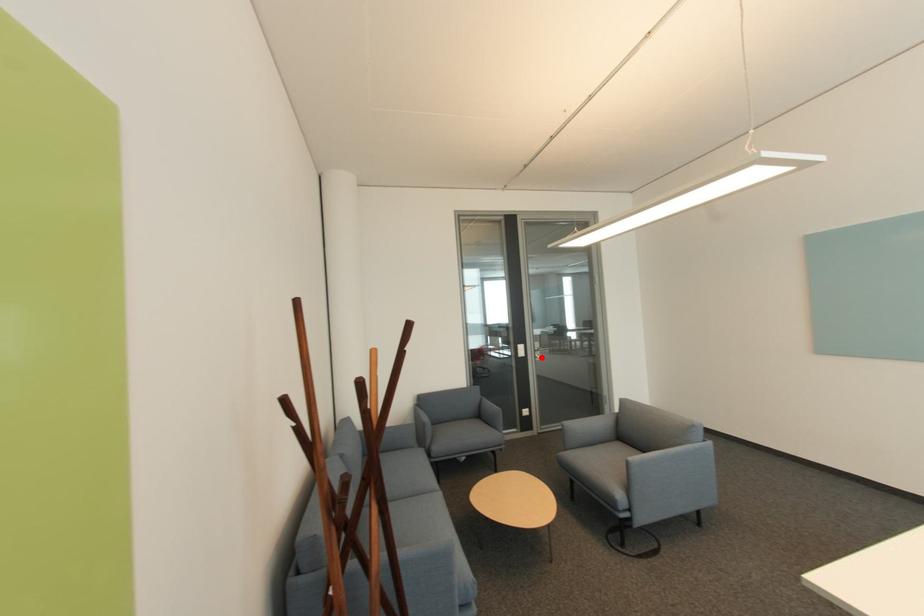
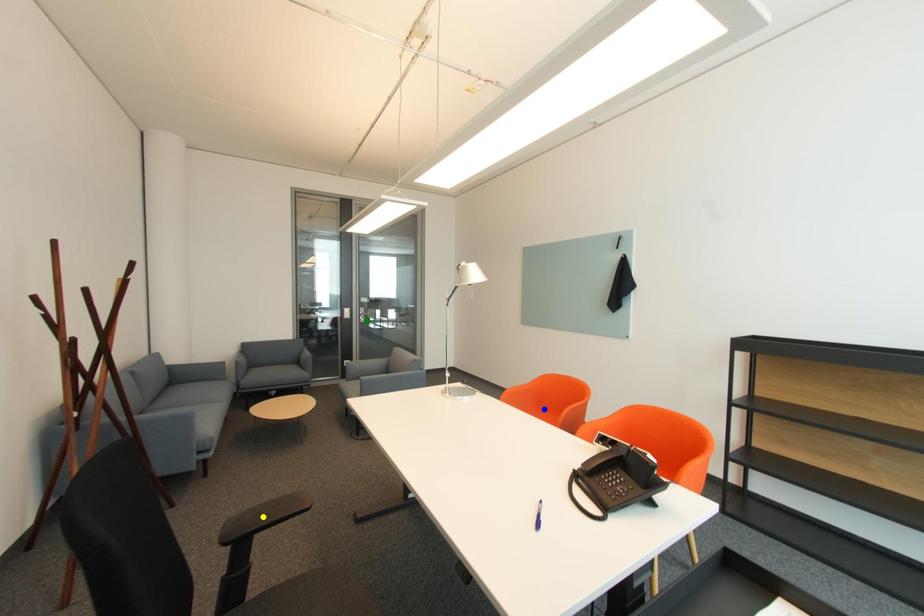
Question: I am providing you with two images of the same scene from different viewpoints. A red point is marked on the first image. You are given multiple points on the second image. In image 2, which mark is for the same physical point as the one in image 1?

Choices:
 (A) yellow point
 (B) blue point
 (C) green point

Answer: (C)